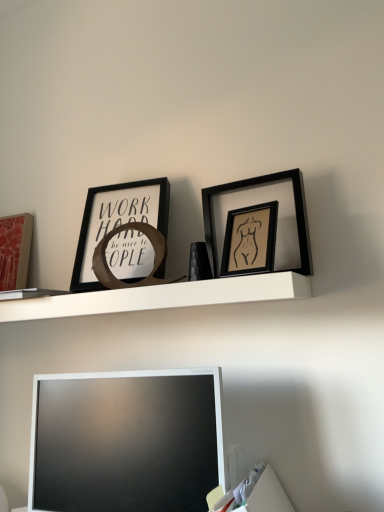
Where is `black matte picture frame at upper right, placed as the 4th picture frame when sorted from left to right`? black matte picture frame at upper right, placed as the 4th picture frame when sorted from left to right is located at coordinates (260, 203).

The width and height of the screenshot is (384, 512). Describe the element at coordinates (117, 221) in the screenshot. I see `matte black picture frame at upper left, which is the second picture frame from left to right` at that location.

Identify the location of white glossy television at lower center. [126, 442].

From the image's perspective, which one is positioned lower, white matte shelf at upper center or matte pink picture frame at left, which is counted as the first picture frame, starting from the left?

white matte shelf at upper center, from the image's perspective.

Is white matte shelf at upper center facing towards matte pink picture frame at left, which ranks as the fourth picture frame in right-to-left order?

No.

Are white matte shelf at upper center and matte pink picture frame at left, which is the 4th picture frame in front-to-back order, beside each other?

No, white matte shelf at upper center is not next to matte pink picture frame at left, which is the 4th picture frame in front-to-back order.

Does white matte shelf at upper center have a smaller size compared to matte pink picture frame at left, the 1th picture frame viewed from the back?

Actually, white matte shelf at upper center might be larger than matte pink picture frame at left, the 1th picture frame viewed from the back.

Is white glossy television at lower center wider than black matte picture frame at upper right, acting as the 2th picture frame starting from the front?

Yes, white glossy television at lower center is wider than black matte picture frame at upper right, acting as the 2th picture frame starting from the front.

Is point (182, 475) positioned behind point (221, 218)?

That is False.

Between white glossy television at lower center and black matte picture frame at upper right, acting as the 2th picture frame starting from the front, which one has smaller size?

black matte picture frame at upper right, acting as the 2th picture frame starting from the front, is smaller.

Is matte black picture frame at upper left, the 2th picture frame from the back, next to black matte picture frame at upper right, acting as the 2th picture frame starting from the front?

matte black picture frame at upper left, the 2th picture frame from the back, is not next to black matte picture frame at upper right, acting as the 2th picture frame starting from the front, and they're not touching.

Considering the relative sizes of matte black picture frame at upper left, the 2th picture frame from the back, and black matte picture frame at upper right, placed as the 4th picture frame when sorted from left to right, in the image provided, is matte black picture frame at upper left, the 2th picture frame from the back, taller than black matte picture frame at upper right, placed as the 4th picture frame when sorted from left to right,?

Yes.

Measure the distance from matte black picture frame at upper left, which is the second picture frame from left to right, to black matte picture frame at upper right, acting as the 2th picture frame starting from the front.

matte black picture frame at upper left, which is the second picture frame from left to right, and black matte picture frame at upper right, acting as the 2th picture frame starting from the front, are 24.37 centimeters apart.

Is matte black picture frame at upper left, which is the second picture frame from left to right, facing away from black matte picture frame at upper right, acting as the 2th picture frame starting from the front?

No.

Can you confirm if matte pink picture frame at left, the 1th picture frame viewed from the back, is wider than white glossy television at lower center?

In fact, matte pink picture frame at left, the 1th picture frame viewed from the back, might be narrower than white glossy television at lower center.

Find the location of a particular element. The image size is (384, 512). television in front of the matte pink picture frame at left, which ranks as the fourth picture frame in right-to-left order is located at coordinates (126, 442).

Is matte pink picture frame at left, which is the 4th picture frame in front-to-back order, aimed at white glossy television at lower center?

No, matte pink picture frame at left, which is the 4th picture frame in front-to-back order, is not turned towards white glossy television at lower center.

Is point (13, 286) positioned before point (59, 403)?

No.

Is black matte picture frame at upper right, which ranks as the 3th picture frame in back-to-front order, a part of matte pink picture frame at left, which ranks as the fourth picture frame in right-to-left order?

No, black matte picture frame at upper right, which ranks as the 3th picture frame in back-to-front order, is not a part of matte pink picture frame at left, which ranks as the fourth picture frame in right-to-left order.

Is matte pink picture frame at left, which is the 4th picture frame in front-to-back order, taller than black matte picture frame at upper right, which ranks as the 3th picture frame in back-to-front order?

Correct, matte pink picture frame at left, which is the 4th picture frame in front-to-back order, is much taller as black matte picture frame at upper right, which ranks as the 3th picture frame in back-to-front order.

Is matte pink picture frame at left, the 1th picture frame viewed from the back, not near black matte picture frame at upper right, positioned as the first picture frame in right-to-left order?

matte pink picture frame at left, the 1th picture frame viewed from the back, is actually quite close to black matte picture frame at upper right, positioned as the first picture frame in right-to-left order.

From a real-world perspective, between matte pink picture frame at left, the 1th picture frame viewed from the back, and black matte picture frame at upper right, placed as the 4th picture frame when sorted from left to right, who is vertically higher?

From a 3D spatial view, matte pink picture frame at left, the 1th picture frame viewed from the back, is above.

Considering the positions of objects matte black picture frame at upper left, which is the 3th picture frame in front-to-back order, and white glossy television at lower center in the image provided, who is more to the left, matte black picture frame at upper left, which is the 3th picture frame in front-to-back order, or white glossy television at lower center?

Positioned to the left is matte black picture frame at upper left, which is the 3th picture frame in front-to-back order.

Is matte black picture frame at upper left, placed as the 3th picture frame when sorted from right to left, far from white glossy television at lower center?

No, matte black picture frame at upper left, placed as the 3th picture frame when sorted from right to left, is not far away from white glossy television at lower center.

Does point (130, 211) lie behind point (73, 421)?

Yes, point (130, 211) is behind point (73, 421).

Is white matte shelf at upper center looking in the opposite direction of matte black picture frame at upper left, the 2th picture frame from the back?

No, matte black picture frame at upper left, the 2th picture frame from the back, is not at the back of white matte shelf at upper center.

From the image's perspective, between white matte shelf at upper center and matte black picture frame at upper left, which is the second picture frame from left to right, who is located below?

white matte shelf at upper center, from the image's perspective.

Between point (198, 295) and point (93, 212), which one is positioned behind?

The point (93, 212) is farther from the camera.

Locate an element on the screen. The image size is (384, 512). picture frame that is the 4th one when counting backward from the white matte shelf at upper center is located at coordinates (15, 250).

Image resolution: width=384 pixels, height=512 pixels. Identify the location of television directly beneath the black matte picture frame at upper right, which ranks as the 3th picture frame in back-to-front order (from a real-world perspective). (126, 442).

Considering their positions, is white matte shelf at upper center positioned closer to white glossy television at lower center than black matte picture frame at upper right, which ranks as the 3th picture frame in back-to-front order?

white matte shelf at upper center is positioned closer to the anchor white glossy television at lower center.

From the picture: Based on their spatial positions, is black matte picture frame at upper right, placed as the 4th picture frame when sorted from left to right, or matte black frame at upper center, the 3th picture frame from the left, closer to matte black picture frame at upper left, the 2th picture frame from the back?

Among the two, black matte picture frame at upper right, placed as the 4th picture frame when sorted from left to right, is located nearer to matte black picture frame at upper left, the 2th picture frame from the back.

Which object lies nearer to the anchor point black matte picture frame at upper right, placed as the 4th picture frame when sorted from left to right, matte black frame at upper center, which is the 2th picture frame from right to left, or white glossy television at lower center?

matte black frame at upper center, which is the 2th picture frame from right to left, is closer to black matte picture frame at upper right, placed as the 4th picture frame when sorted from left to right.

Considering their positions, is matte pink picture frame at left, which ranks as the fourth picture frame in right-to-left order, positioned closer to white matte shelf at upper center than black matte picture frame at upper right, positioned as the first picture frame in right-to-left order?

The object closer to white matte shelf at upper center is black matte picture frame at upper right, positioned as the first picture frame in right-to-left order.

Consider the image. Looking at the image, which one is located closer to matte black picture frame at upper left, placed as the 3th picture frame when sorted from right to left, matte pink picture frame at left, the 1th picture frame viewed from the back, or matte black frame at upper center, the 3th picture frame from the left?

Among the two, matte black frame at upper center, the 3th picture frame from the left, is located nearer to matte black picture frame at upper left, placed as the 3th picture frame when sorted from right to left.

When comparing their distances from white glossy television at lower center, does black matte picture frame at upper right, which ranks as the 3th picture frame in back-to-front order, or matte black frame at upper center, the first picture frame in the front-to-back sequence, seem further?

black matte picture frame at upper right, which ranks as the 3th picture frame in back-to-front order, is positioned further to the anchor white glossy television at lower center.

Based on their spatial positions, is white matte shelf at upper center or matte black picture frame at upper left, placed as the 3th picture frame when sorted from right to left, closer to matte pink picture frame at left, which ranks as the fourth picture frame in right-to-left order?

matte black picture frame at upper left, placed as the 3th picture frame when sorted from right to left, lies closer to matte pink picture frame at left, which ranks as the fourth picture frame in right-to-left order, than the other object.

Looking at the image, which one is located further to black matte picture frame at upper right, placed as the 4th picture frame when sorted from left to right, matte black picture frame at upper left, which is the second picture frame from left to right, or white glossy television at lower center?

Among the two, white glossy television at lower center is located further to black matte picture frame at upper right, placed as the 4th picture frame when sorted from left to right.

What are the coordinates of `picture frame situated between white matte shelf at upper center and matte black frame at upper center, which is the 2th picture frame from right to left, from left to right` in the screenshot? It's located at (117, 221).

This screenshot has height=512, width=384. What are the coordinates of `shelf between matte black picture frame at upper left, which is the 3th picture frame in front-to-back order, and white glossy television at lower center, in the vertical direction` in the screenshot? It's located at (161, 297).

In order to click on shelf between matte pink picture frame at left, which is counted as the first picture frame, starting from the left, and matte black frame at upper center, the first picture frame in the front-to-back sequence, from left to right in this screenshot , I will do `click(161, 297)`.

Where is `shelf between black matte picture frame at upper right, positioned as the first picture frame in right-to-left order, and white glossy television at lower center in the up-down direction`? This screenshot has width=384, height=512. shelf between black matte picture frame at upper right, positioned as the first picture frame in right-to-left order, and white glossy television at lower center in the up-down direction is located at coordinates (161, 297).